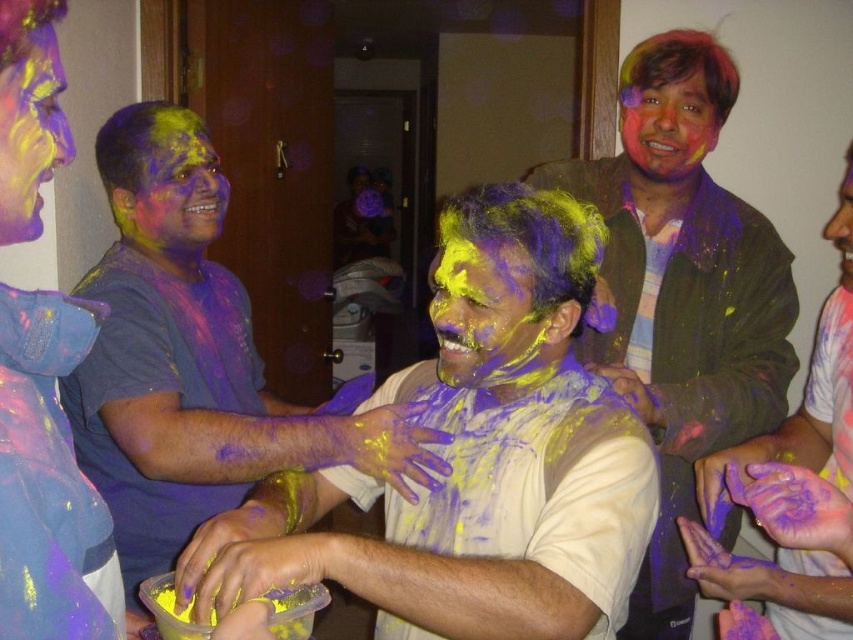
Is matte yellow paint at center smaller than smooth skin face at upper right?

No.

Does matte yellow paint at center appear on the right side of smooth skin face at upper right?

In fact, matte yellow paint at center is to the left of smooth skin face at upper right.

Find the location of a particular element. The image size is (853, 640). matte yellow paint at center is located at coordinates (477, 458).

This screenshot has width=853, height=640. In order to click on matte yellow paint at center in this screenshot , I will do `click(477, 458)`.

Between point (215, 209) and point (642, 104), which one is positioned behind?

The point (215, 209) is behind.

Can you confirm if matte purple face at center is positioned above multicolored paint at upper right?

Actually, matte purple face at center is below multicolored paint at upper right.

Between point (143, 157) and point (691, 161), which one is positioned behind?

The point (691, 161) is more distant.

This screenshot has width=853, height=640. I want to click on matte purple face at center, so click(177, 193).

In the scene shown: How much distance is there between matte purple shirt at center and matte green shirt at right?

A distance of 29.09 inches exists between matte purple shirt at center and matte green shirt at right.

Does matte purple shirt at center have a greater height compared to matte green shirt at right?

Yes, matte purple shirt at center is taller than matte green shirt at right.

At what (x,y) coordinates should I click in order to perform the action: click on matte purple shirt at center. Please return your answer as a coordinate pair (x, y). This screenshot has height=640, width=853. Looking at the image, I should click on (194, 358).